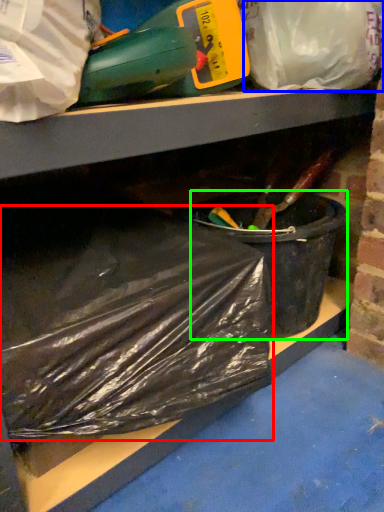
Question: Estimate the real-world distances between objects in this image. Which object is closer to plastic bag (highlighted by a red box), plastic bag (highlighted by a blue box) or recycling bin (highlighted by a green box)?

Choices:
 (A) plastic bag
 (B) recycling bin

Answer: (B)